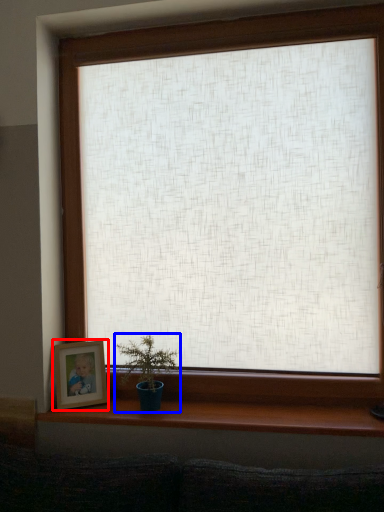
Question: Which object is closer to the camera taking this photo, picture frame (highlighted by a red box) or houseplant (highlighted by a blue box)?

Choices:
 (A) picture frame
 (B) houseplant

Answer: (B)